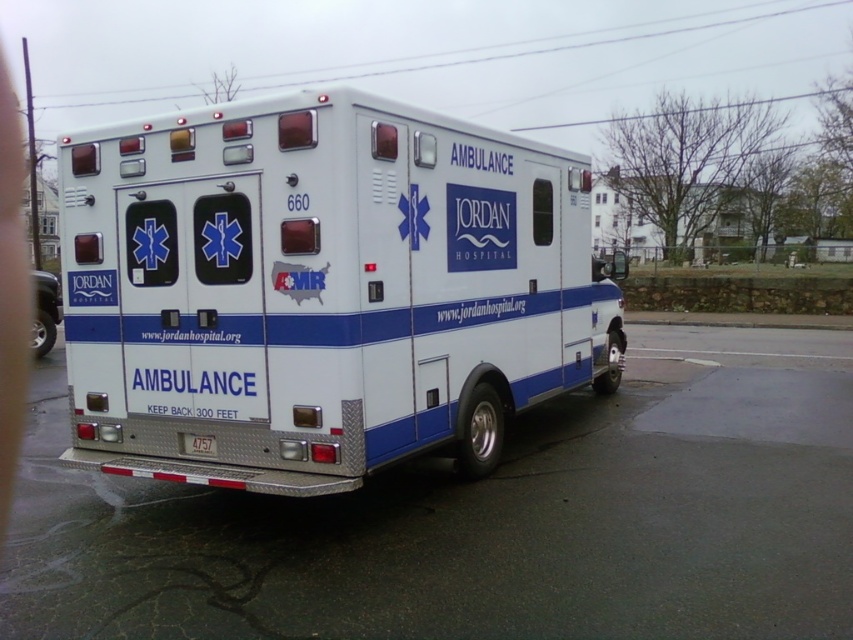
Who is taller, white metallic ambulance at center or white plastic license plate at rear?

Standing taller between the two is white metallic ambulance at center.

Is white metallic ambulance at center to the left of white plastic license plate at rear from the viewer's perspective?

In fact, white metallic ambulance at center is to the right of white plastic license plate at rear.

Who is more forward, (514, 355) or (209, 445)?

Positioned in front is point (209, 445).

Where is `white metallic ambulance at center`? The image size is (853, 640). white metallic ambulance at center is located at coordinates (322, 289).

Does point (570, 380) come farther from viewer compared to point (42, 346)?

No, (570, 380) is closer to viewer.

Is point (432, 170) closer to camera compared to point (36, 305)?

Yes, it is in front of point (36, 305).

Locate an element on the screen. The image size is (853, 640). white metallic ambulance at center is located at coordinates (322, 289).

The height and width of the screenshot is (640, 853). I want to click on white metallic ambulance at center, so point(322,289).

Can you confirm if white glossy ambulance at center is bigger than white plastic license plate at rear?

Indeed, white glossy ambulance at center has a larger size compared to white plastic license plate at rear.

Who is more distant from viewer, (41,342) or (193,438)?

The point (41,342) is more distant.

Is point (44, 308) farther from viewer compared to point (193, 449)?

Yes, it is.

This screenshot has width=853, height=640. Find the location of `white glossy ambulance at center`. white glossy ambulance at center is located at coordinates (45, 310).